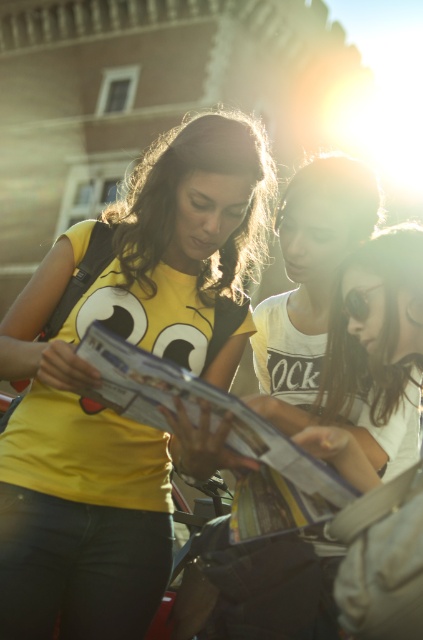
You are standing in the scene and want to hand a leaflet to the person wearing the white matte shirt at center. Based on their position, which direction should you approach from to ensure you are facing them directly?

Since the white matte shirt at center is located at point (308, 285), you should approach from the front to face them directly.